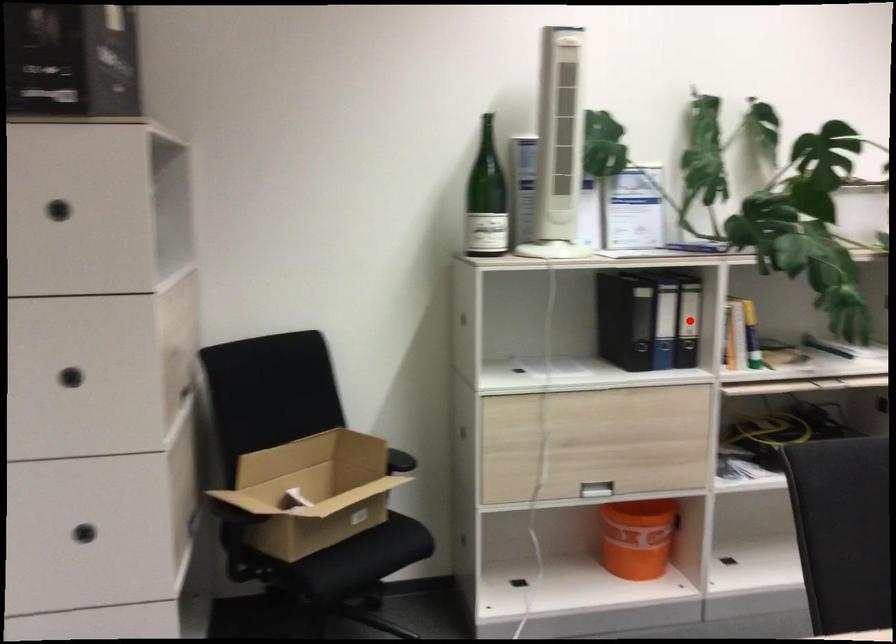
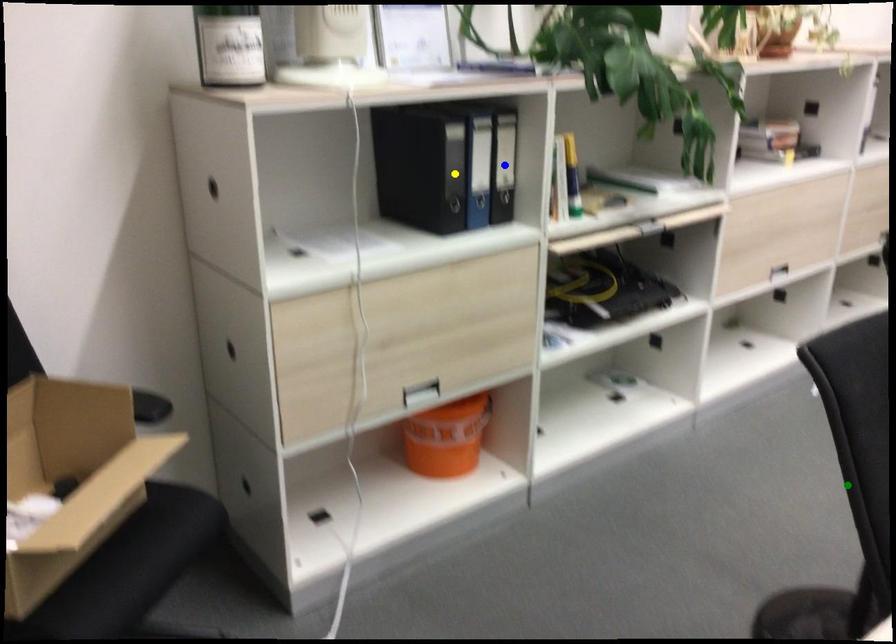
Question: I am providing you with two images of the same scene from different viewpoints. A red point is marked on the first image. You are given multiple points on the second image. Which point in image 2 is actually the same real-world point as the red point in image 1?

Choices:
 (A) yellow point
 (B) blue point
 (C) green point

Answer: (B)